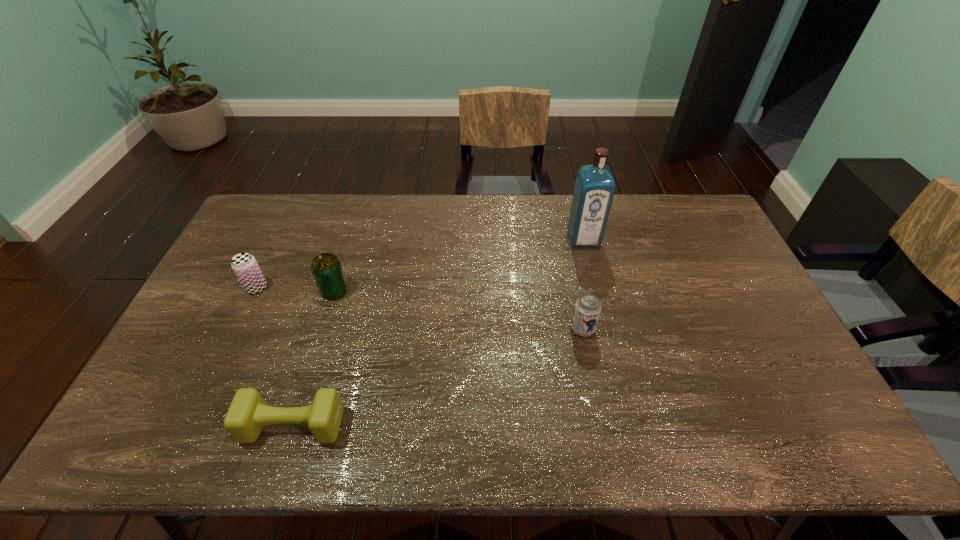
Where is `vacant space located 0.260m on the right of the leftmost beer can`? The image size is (960, 540). vacant space located 0.260m on the right of the leftmost beer can is located at coordinates (350, 288).

The width and height of the screenshot is (960, 540). What are the coordinates of `free location located 0.370m on the right of the second nearest object` in the screenshot? It's located at (725, 329).

This screenshot has height=540, width=960. I want to click on free region located 0.120m on the back of the nearest object, so click(x=312, y=365).

At what (x,y) coordinates should I click in order to perform the action: click on object that is at the far edge. Please return your answer as a coordinate pair (x, y). Image resolution: width=960 pixels, height=540 pixels. Looking at the image, I should click on (595, 186).

Where is `object that is positioned at the near edge`? object that is positioned at the near edge is located at coordinates (248, 413).

This screenshot has width=960, height=540. What are the coordinates of `object present at the left edge` in the screenshot? It's located at click(x=244, y=265).

In the image, there is a desktop. Where is `vacant space at the far edge`? vacant space at the far edge is located at coordinates (630, 213).

The width and height of the screenshot is (960, 540). What are the coordinates of `free location at the near edge` in the screenshot? It's located at (343, 437).

In the image, there is a desktop. Identify the location of blank space at the left edge. (209, 315).

Find the location of a particular element. This screenshot has width=960, height=540. free space at the right edge of the desktop is located at coordinates (726, 297).